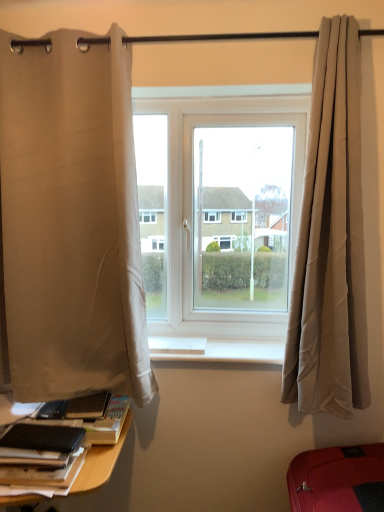
Question: Is black matte book at lower left shorter than white fabric curtain at left, the second curtain from the right?

Choices:
 (A) no
 (B) yes

Answer: (B)

Question: Considering the relative positions of black matte book at lower left and white fabric curtain at left, the first curtain viewed from the left, in the image provided, is black matte book at lower left to the left of white fabric curtain at left, the first curtain viewed from the left, from the viewer's perspective?

Choices:
 (A) yes
 (B) no

Answer: (A)

Question: Considering the relative sizes of black matte book at lower left and white fabric curtain at left, the second curtain from the right, in the image provided, is black matte book at lower left wider than white fabric curtain at left, the second curtain from the right,?

Choices:
 (A) yes
 (B) no

Answer: (A)

Question: From a real-world perspective, is black matte book at lower left physically above white fabric curtain at left, the first curtain viewed from the left?

Choices:
 (A) yes
 (B) no

Answer: (B)

Question: Is black matte book at lower left far away from white fabric curtain at left, the first curtain viewed from the left?

Choices:
 (A) no
 (B) yes

Answer: (A)

Question: Is black matte book at lower left next to white fabric curtain at left, the first curtain viewed from the left, and touching it?

Choices:
 (A) no
 (B) yes

Answer: (A)

Question: Is beige fabric curtain at right, the 2th curtain when ordered from left to right, taller than black matte book at lower left?

Choices:
 (A) yes
 (B) no

Answer: (A)

Question: Can you confirm if beige fabric curtain at right, the 2th curtain when ordered from left to right, is bigger than black matte book at lower left?

Choices:
 (A) no
 (B) yes

Answer: (B)

Question: Is beige fabric curtain at right, the first curtain from the right, not inside black matte book at lower left?

Choices:
 (A) no
 (B) yes

Answer: (B)

Question: From a real-world perspective, is beige fabric curtain at right, the 2th curtain when ordered from left to right, positioned over black matte book at lower left based on gravity?

Choices:
 (A) no
 (B) yes

Answer: (B)

Question: Is black matte book at lower left surrounded by beige fabric curtain at right, the 2th curtain when ordered from left to right?

Choices:
 (A) no
 (B) yes

Answer: (A)

Question: Could you tell me if beige fabric curtain at right, the first curtain from the right, is facing black matte book at lower left?

Choices:
 (A) no
 (B) yes

Answer: (A)

Question: From a real-world perspective, is beige fabric curtain at right, the first curtain from the right, positioned over white smooth window sill at center based on gravity?

Choices:
 (A) no
 (B) yes

Answer: (B)